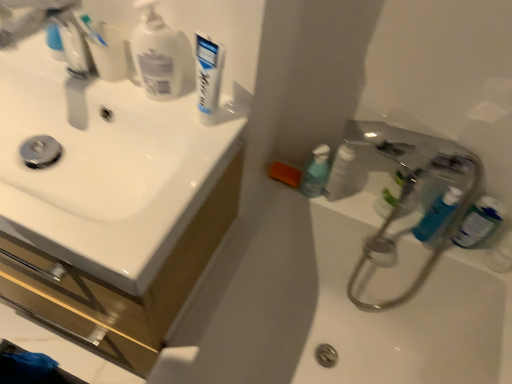
Question: From a real-world perspective, is blue plastic mouthwash at right, marked as the third mouthwash in a left-to-right arrangement, below white glossy sink at upper left?

Choices:
 (A) no
 (B) yes

Answer: (A)

Question: Is blue plastic mouthwash at right, marked as the third mouthwash in a left-to-right arrangement, beside white glossy sink at upper left?

Choices:
 (A) yes
 (B) no

Answer: (B)

Question: From the image's perspective, is blue plastic mouthwash at right, which is the 1th mouthwash from right to left, over white glossy sink at upper left?

Choices:
 (A) yes
 (B) no

Answer: (A)

Question: Can you confirm if blue plastic mouthwash at right, marked as the third mouthwash in a left-to-right arrangement, is bigger than white glossy sink at upper left?

Choices:
 (A) yes
 (B) no

Answer: (B)

Question: Can you confirm if blue plastic mouthwash at right, which is the 1th mouthwash from right to left, is positioned to the left of white glossy sink at upper left?

Choices:
 (A) yes
 (B) no

Answer: (B)

Question: From a real-world perspective, relative to white glossy sink at upper left, is white glossy toothpaste tube at right, positioned as the third toiletry in right-to-left order, vertically above or below?

Choices:
 (A) below
 (B) above

Answer: (B)

Question: In the image, is white glossy toothpaste tube at right, which is counted as the first toiletry, starting from the left, positioned in front of or behind white glossy sink at upper left?

Choices:
 (A) behind
 (B) front

Answer: (A)

Question: Considering the positions of point (342, 145) and point (173, 276), is point (342, 145) closer or farther from the camera than point (173, 276)?

Choices:
 (A) farther
 (B) closer

Answer: (A)

Question: Looking at their shapes, would you say white glossy toothpaste tube at right, positioned as the third toiletry in right-to-left order, is wider or thinner than white glossy sink at upper left?

Choices:
 (A) wide
 (B) thin

Answer: (B)

Question: Is point (474, 225) closer or farther from the camera than point (155, 96)?

Choices:
 (A) farther
 (B) closer

Answer: (A)

Question: Looking at the image, does blue plastic mouthwash at right, marked as the third mouthwash in a left-to-right arrangement, seem bigger or smaller compared to white matte pump bottle at upper left?

Choices:
 (A) big
 (B) small

Answer: (A)

Question: Considering their positions, is blue plastic mouthwash at right, which is the 1th mouthwash from right to left, located in front of or behind white matte pump bottle at upper left?

Choices:
 (A) front
 (B) behind

Answer: (B)

Question: Which is correct: blue plastic mouthwash at right, marked as the third mouthwash in a left-to-right arrangement, is inside white matte pump bottle at upper left, or outside of it?

Choices:
 (A) outside
 (B) inside

Answer: (A)

Question: From the image's perspective, relative to blue glossy bottle at right, the 3th toiletry positioned from the left, is white matte pump bottle at upper left above or below?

Choices:
 (A) above
 (B) below

Answer: (A)

Question: Does point (158, 77) appear closer or farther from the camera than point (496, 251)?

Choices:
 (A) farther
 (B) closer

Answer: (B)